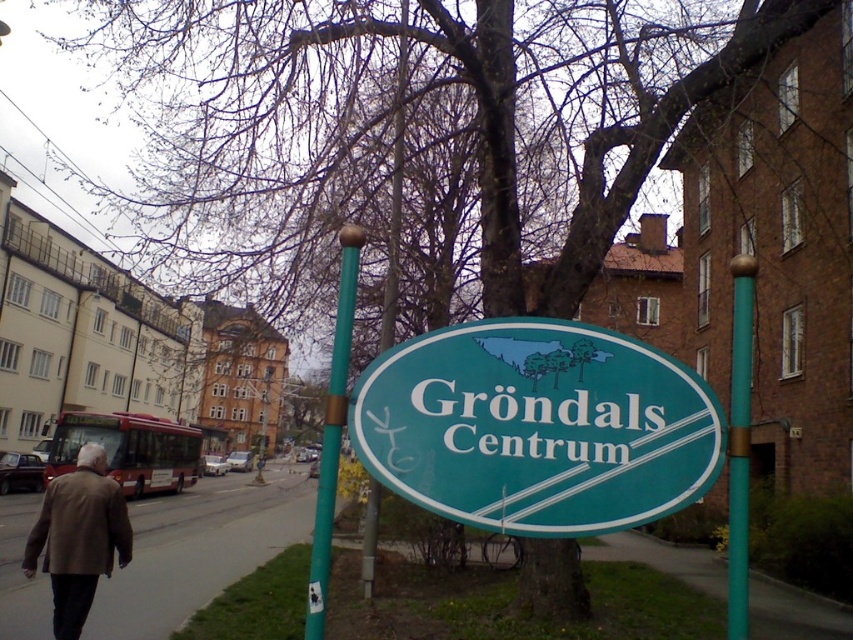
Can you confirm if gray asphalt at lower left is taller than brown leather jacket at lower left?

Yes, gray asphalt at lower left is taller than brown leather jacket at lower left.

Measure the distance from gray asphalt at lower left to brown leather jacket at lower left.

A distance of 5.21 meters exists between gray asphalt at lower left and brown leather jacket at lower left.

The image size is (853, 640). In order to click on gray asphalt at lower left in this screenshot , I will do `click(199, 548)`.

Locate an element on the screen. gray asphalt at lower left is located at coordinates (199, 548).

Based on the photo, which of these two, green plastic sign at center or teal painted metal pole at center, stands shorter?

A: green plastic sign at center is shorter.

Is point (633, 403) in front of point (746, 508)?

No.

The height and width of the screenshot is (640, 853). I want to click on green plastic sign at center, so click(537, 428).

Looking at this image, is green plastic sign at center to the left of brown leather jacket at lower left from the viewer's perspective?

No, green plastic sign at center is not to the left of brown leather jacket at lower left.

Between green plastic sign at center and brown leather jacket at lower left, which one appears on the right side from the viewer's perspective?

green plastic sign at center is more to the right.

Which is behind, point (585, 429) or point (51, 568)?

Point (51, 568)

I want to click on green plastic sign at center, so click(537, 428).